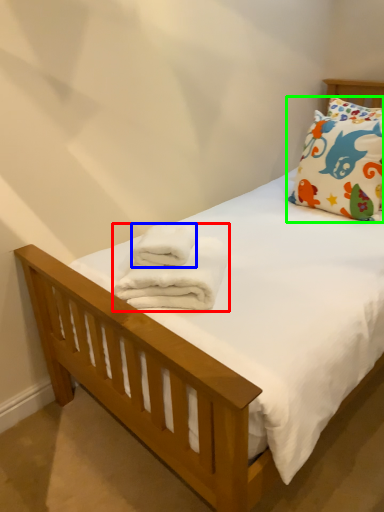
Question: Which object is positioned closest to bath towel (highlighted by a red box)? Select from bath towel (highlighted by a blue box) and pillow (highlighted by a green box).

Choices:
 (A) bath towel
 (B) pillow

Answer: (A)